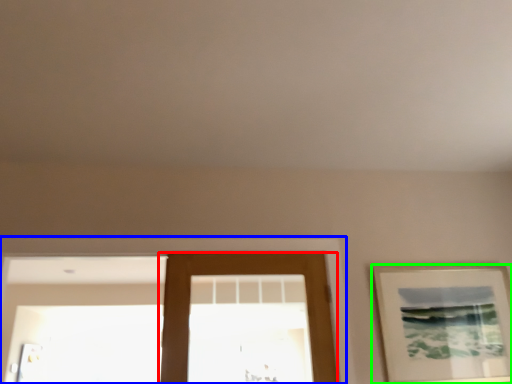
Question: Based on their relative distances, which object is nearer to door (highlighted by a red box)? Choose from window frame (highlighted by a blue box) and picture frame (highlighted by a green box).

Choices:
 (A) window frame
 (B) picture frame

Answer: (A)